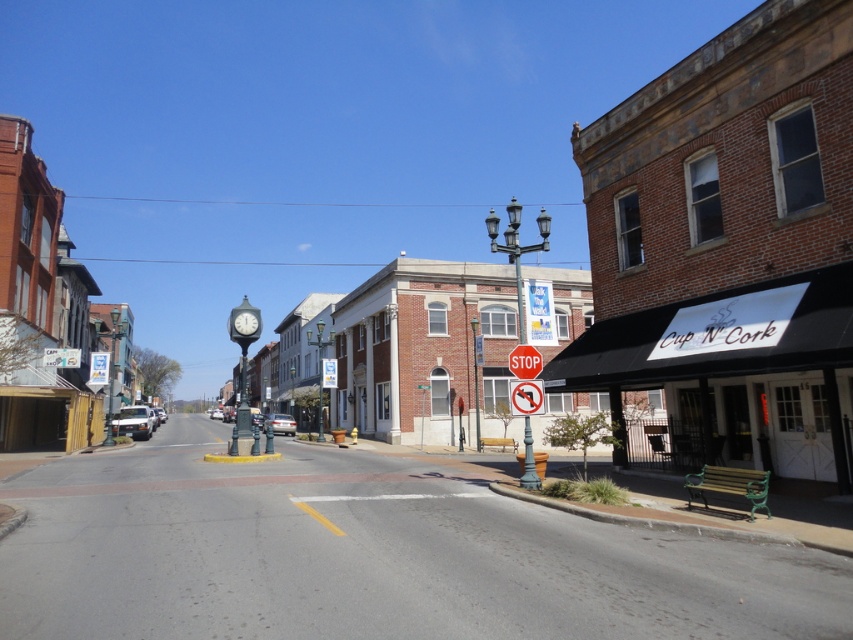
From the picture: Is red plastic stop sign at center wider than red matte stop sign at center?

Correct, the width of red plastic stop sign at center exceeds that of red matte stop sign at center.

Is red plastic stop sign at center above red matte stop sign at center?

Incorrect, red plastic stop sign at center is not positioned above red matte stop sign at center.

Between point (511, 401) and point (518, 365), which one is positioned behind?

Point (511, 401)

You are a GUI agent. You are given a task and a screenshot of the screen. Output one action in this format:
    pyautogui.click(x=<x>, y=<y>)
    Task: Click on the red plastic stop sign at center
    Image resolution: width=853 pixels, height=640 pixels.
    Given the screenshot: What is the action you would take?
    pyautogui.click(x=526, y=396)

Which of these two, brick building at left or metallic pole at center-right, stands shorter?

metallic pole at center-right is shorter.

Can you confirm if brick building at left is positioned above metallic pole at center-right?

Correct, brick building at left is located above metallic pole at center-right.

Image resolution: width=853 pixels, height=640 pixels. Identify the location of brick building at left. (51, 316).

Can you confirm if brick building at left is taller than red plastic stop sign at center?

Yes.

Can you confirm if brick building at left is positioned below red plastic stop sign at center?

No, brick building at left is not below red plastic stop sign at center.

Image resolution: width=853 pixels, height=640 pixels. What are the coordinates of `brick building at left` in the screenshot? It's located at (51, 316).

Locate an element on the screen. brick building at left is located at coordinates (51, 316).